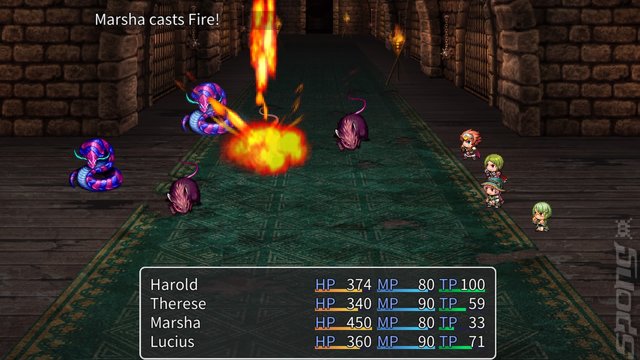
Identify the location of tattered rug. This screenshot has width=640, height=360. (548, 326), (404, 177), (347, 62).